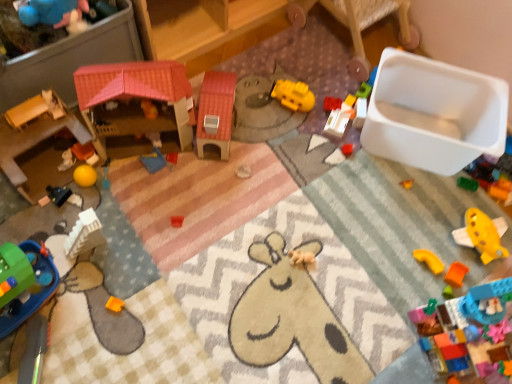
Locate an element on the screen. Image resolution: width=512 pixels, height=384 pixels. free space that is in between yellow plastic block at upper center, the fifth toy from the right, and orange matte block at lower right, which ranks as the second toy in right-to-left order is located at coordinates (412, 214).